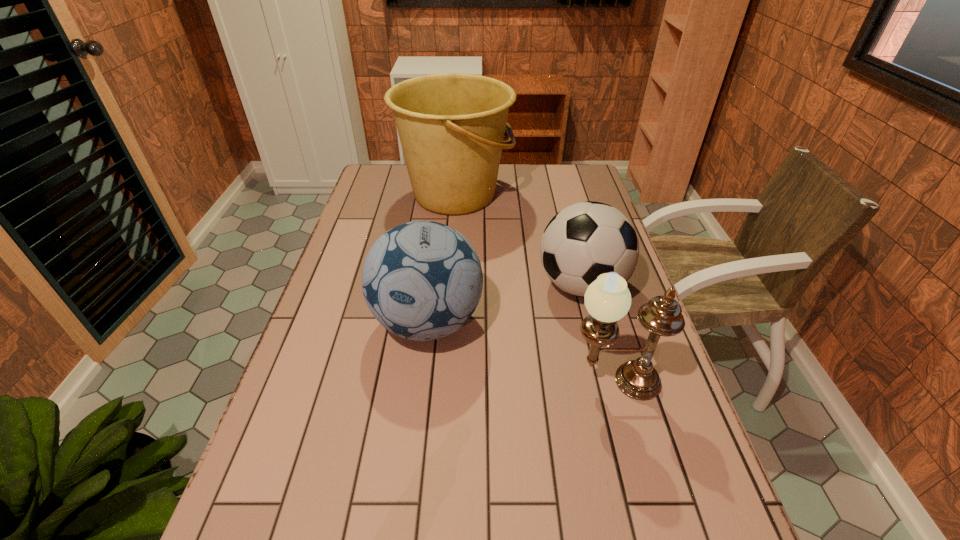
This screenshot has width=960, height=540. Identify the location of free space in the image that satisfies the following two spatial constraints: 1. on the side with brand of the left soccer ball; 2. on the right side of the oil lamp. (420, 382).